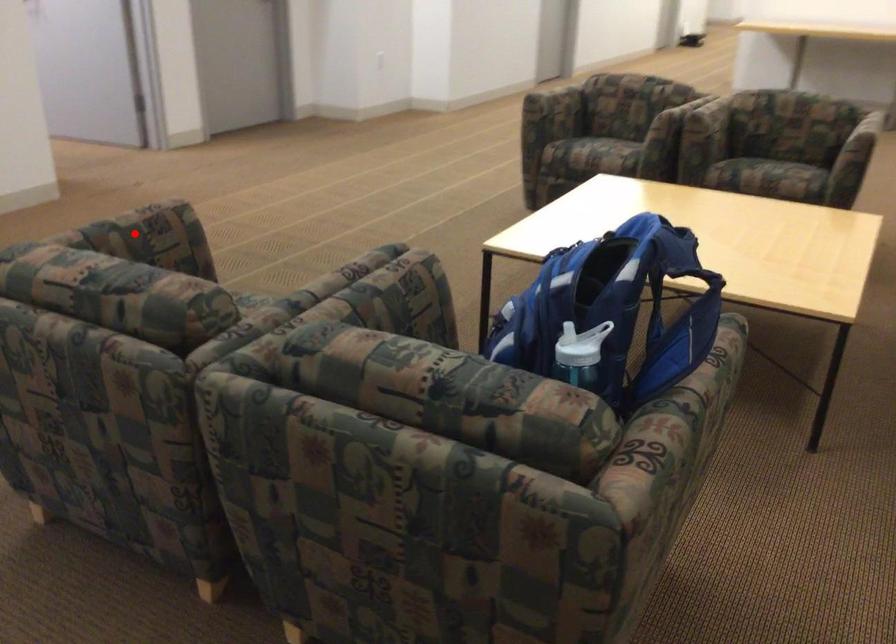
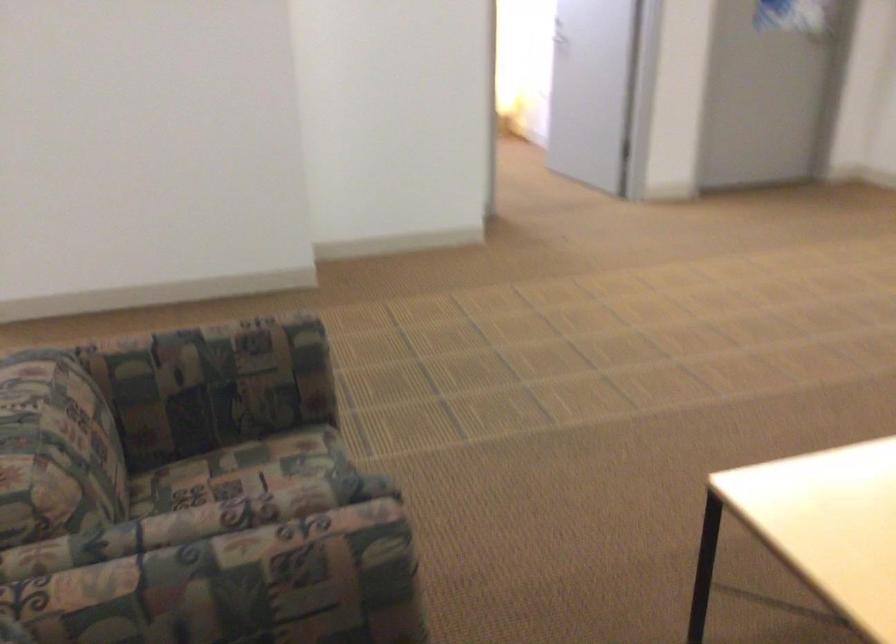
Find the pixel in the second image that matches the highlighted location in the first image.

(218, 351)